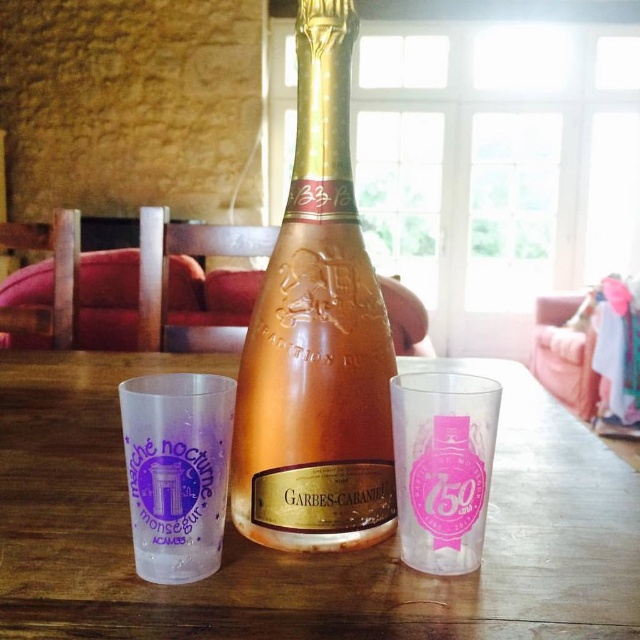
You are a server at a party and need to place a 12 inch long bottle of wine between the wooden table at center and the transparent plastic cup at lower left. Is there enough space?

The distance between the wooden table at center and the transparent plastic cup at lower left is 15.86 inches. Since the bottle is 12 inches long, there is enough space to place it between them.

You are setting up a table for a party and have a pink glass bottle at center and a transparent plastic cup at center. If you want to place a decorative item between them, which object should you consider the width of to ensure it fits?

You should consider the width of the pink glass bottle at center because it might be wider than the transparent plastic cup at center, so the decorative item needs to fit within the narrower space between them.

You are arranging drinks at a party and need to place a new cup between the transparent plastic cup at lower left and the transparent plastic cup at center. According to the scene, where should you place the new cup to maintain the existing arrangement?

The transparent plastic cup at lower left is positioned on the left side of transparent plastic cup at center, so you should place the new cup to the right of the transparent plastic cup at lower left and to the left of the transparent plastic cup at center to maintain the existing arrangement.